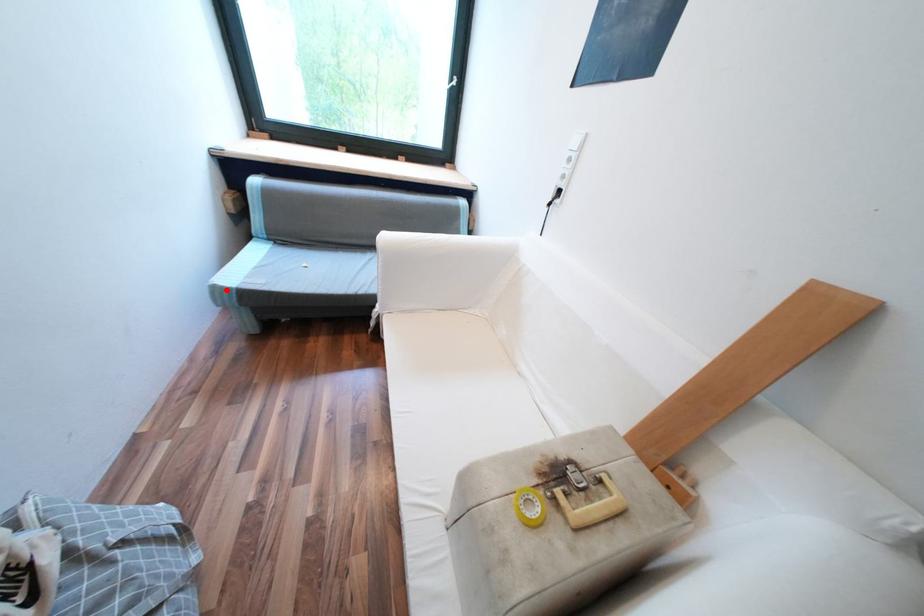
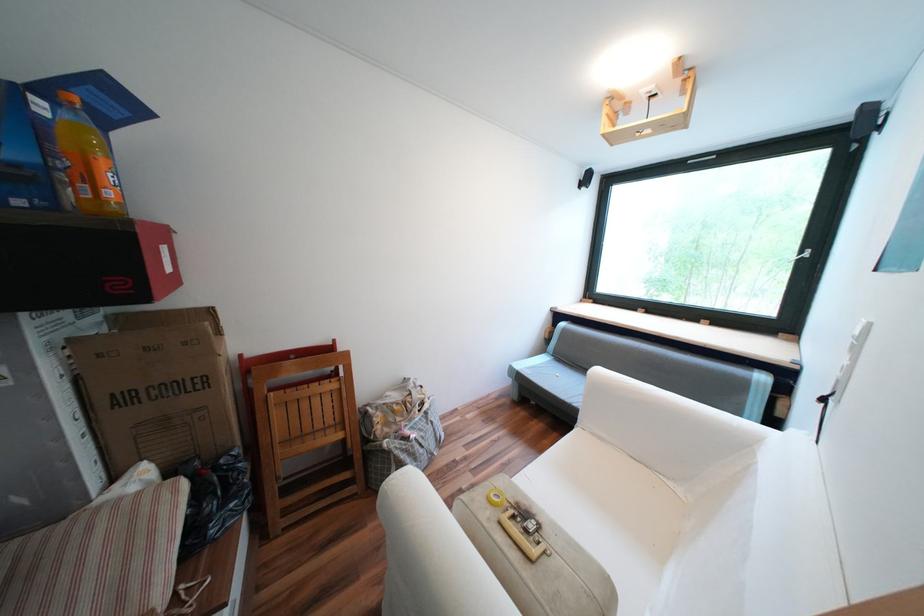
Where in the second image is the point corresponding to the highlighted location from the first image?

(520, 369)